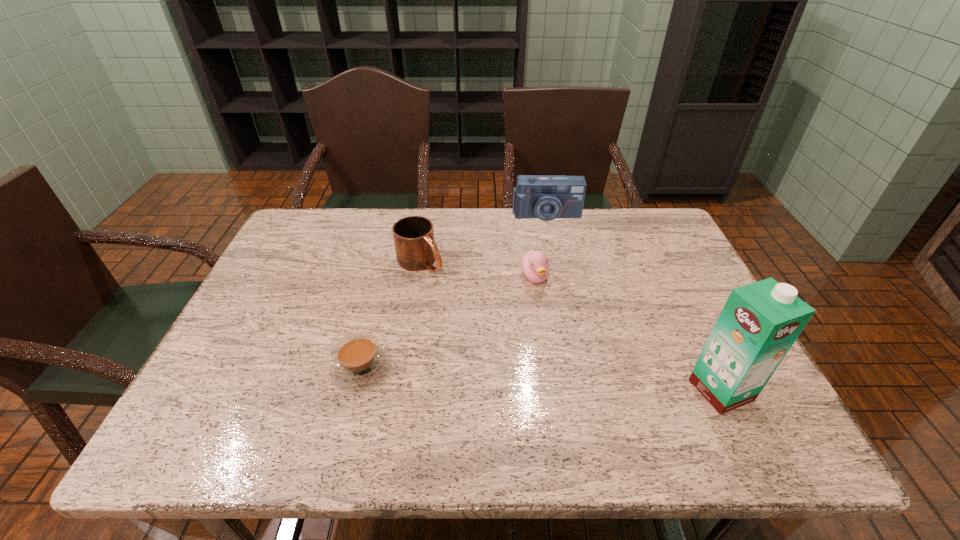
The image size is (960, 540). In order to click on the shortest object in this screenshot , I will do click(359, 362).

Identify the location of carton. (760, 322).

Image resolution: width=960 pixels, height=540 pixels. Identify the location of the rightmost object. (760, 322).

Where is `duckling`? This screenshot has width=960, height=540. duckling is located at coordinates (535, 265).

Locate an element on the screen. The image size is (960, 540). mug is located at coordinates (415, 247).

At what (x,y) coordinates should I click in order to perform the action: click on camera. Please return your answer as a coordinate pair (x, y). Looking at the image, I should click on (546, 197).

Where is `the farthest object`? Image resolution: width=960 pixels, height=540 pixels. the farthest object is located at coordinates (546, 197).

Identify the location of free space located on the left of the shortest object. (263, 368).

Where is `free space located 0.330m on the left of the tallest object`? free space located 0.330m on the left of the tallest object is located at coordinates (537, 390).

Where is `vacant area situated 0.200m on the front-facing side of the duckling`? vacant area situated 0.200m on the front-facing side of the duckling is located at coordinates (570, 348).